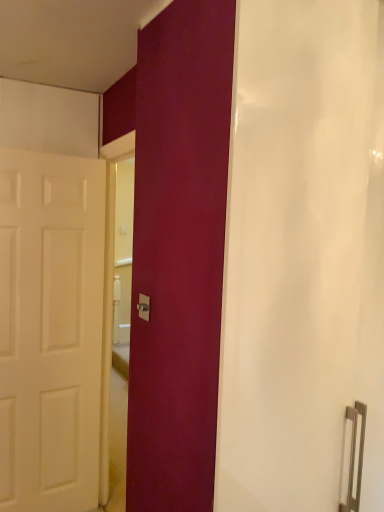
This screenshot has height=512, width=384. Find the location of `matte silver switch at center`. matte silver switch at center is located at coordinates (144, 307).

Describe the element at coordinates (144, 307) in the screenshot. The height and width of the screenshot is (512, 384). I see `matte silver switch at center` at that location.

What do you see at coordinates (303, 256) in the screenshot? I see `matte white shower curtain at center` at bounding box center [303, 256].

This screenshot has width=384, height=512. Describe the element at coordinates (50, 330) in the screenshot. I see `white matte door at left` at that location.

The image size is (384, 512). What are the coordinates of `matte silver switch at center` in the screenshot? It's located at [144, 307].

Can you see matte white shower curtain at center touching white matte door at left?

No.

Considering the sizes of objects matte white shower curtain at center and white matte door at left in the image provided, who is thinner, matte white shower curtain at center or white matte door at left?

white matte door at left.

Would you say matte white shower curtain at center is outside white matte door at left?

Yes, matte white shower curtain at center is outside of white matte door at left.

Based on the photo, considering the sizes of objects matte white shower curtain at center and white matte door at left in the image provided, who is smaller, matte white shower curtain at center or white matte door at left?

white matte door at left is smaller.

Is matte white shower curtain at center at the back of white matte door at left?

No.

From the image's perspective, which is above, white matte door at left or matte white shower curtain at center?

From the image's view, white matte door at left is above.

From a real-world perspective, is white matte door at left above or below matte white shower curtain at center?

Clearly, from a real-world perspective, white matte door at left is below matte white shower curtain at center.

Does white matte door at left touch matte white shower curtain at center?

white matte door at left and matte white shower curtain at center are clearly separated.

From the image's perspective, would you say matte silver switch at center is shown under matte white shower curtain at center?

No, from the image's perspective, matte silver switch at center is not below matte white shower curtain at center.

Which of these two, matte silver switch at center or matte white shower curtain at center, is bigger?

With larger size is matte white shower curtain at center.

There is a matte white shower curtain at center. At what (x,y) coordinates should I click in order to perform the action: click on electric outlet above it (from a real-world perspective). Please return your answer as a coordinate pair (x, y). Looking at the image, I should click on (144, 307).

How much distance is there between white matte door at left and matte silver switch at center?

white matte door at left is 1.03 meters away from matte silver switch at center.

Is white matte door at left at the right side of matte silver switch at center?

In fact, white matte door at left is to the left of matte silver switch at center.

Considering the relative sizes of white matte door at left and matte silver switch at center in the image provided, is white matte door at left thinner than matte silver switch at center?

No, white matte door at left is not thinner than matte silver switch at center.

Locate an element on the screen. This screenshot has width=384, height=512. door below the matte silver switch at center (from the image's perspective) is located at coordinates (50, 330).

From the image's perspective, is matte white shower curtain at center positioned above or below matte silver switch at center?

matte white shower curtain at center is situated lower than matte silver switch at center in the image.

Considering the relative positions of matte white shower curtain at center and matte silver switch at center in the image provided, is matte white shower curtain at center in front of matte silver switch at center?

Yes.

Is point (331, 294) closer or farther from the camera than point (144, 312)?

Point (331, 294).

Does matte white shower curtain at center have a smaller size compared to matte silver switch at center?

No, matte white shower curtain at center is not smaller than matte silver switch at center.

Are matte silver switch at center and white matte door at left far apart?

Yes.

Could white matte door at left be considered to be inside matte silver switch at center?

No, white matte door at left is located outside of matte silver switch at center.

Is matte silver switch at center facing towards white matte door at left?

No.

Between matte silver switch at center and white matte door at left, which one has smaller width?

Thinner between the two is matte silver switch at center.

Locate an element on the screen. This screenshot has height=512, width=384. shower curtain lying in front of the white matte door at left is located at coordinates (303, 256).

This screenshot has height=512, width=384. Find the location of `door below the matte white shower curtain at center (from a real-world perspective)`. door below the matte white shower curtain at center (from a real-world perspective) is located at coordinates (50, 330).

When comparing their distances from matte white shower curtain at center, does matte silver switch at center or white matte door at left seem further?

The object further to matte white shower curtain at center is white matte door at left.

Considering their positions, is white matte door at left positioned closer to matte white shower curtain at center than matte silver switch at center?

matte silver switch at center.

From the image, which object appears to be farther from white matte door at left, matte white shower curtain at center or matte silver switch at center?

matte white shower curtain at center is positioned further to the anchor white matte door at left.

Looking at the image, which one is located further to matte silver switch at center, matte white shower curtain at center or white matte door at left?

white matte door at left is further to matte silver switch at center.

Looking at the image, which one is located further to matte silver switch at center, white matte door at left or matte white shower curtain at center?

Among the two, white matte door at left is located further to matte silver switch at center.

Based on their spatial positions, is matte silver switch at center or matte white shower curtain at center closer to white matte door at left?

matte silver switch at center lies closer to white matte door at left than the other object.

This screenshot has width=384, height=512. Find the location of `electric outlet located between white matte door at left and matte white shower curtain at center in the left-right direction`. electric outlet located between white matte door at left and matte white shower curtain at center in the left-right direction is located at coordinates (144, 307).